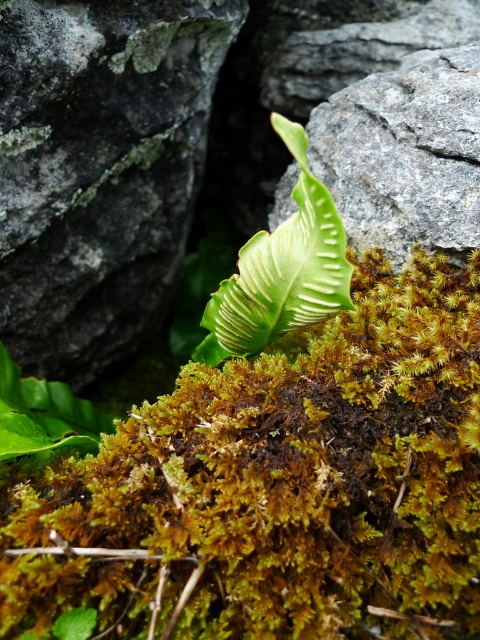
Question: Which point is closer to the camera?

Choices:
 (A) (147, 177)
 (B) (201, 353)

Answer: (B)

Question: Which point is farther from the camera taking this photo?

Choices:
 (A) (98, 88)
 (B) (245, 300)

Answer: (A)

Question: Which of the following is the farthest from the observer?

Choices:
 (A) (205, 45)
 (B) (289, 134)

Answer: (A)

Question: Is gray rough boulder at center to the right of green matte leaf at center from the viewer's perspective?

Choices:
 (A) no
 (B) yes

Answer: (A)

Question: Can you confirm if gray rough boulder at center is smaller than green matte leaf at center?

Choices:
 (A) no
 (B) yes

Answer: (A)

Question: Is gray rough boulder at center below green matte leaf at center?

Choices:
 (A) yes
 (B) no

Answer: (B)